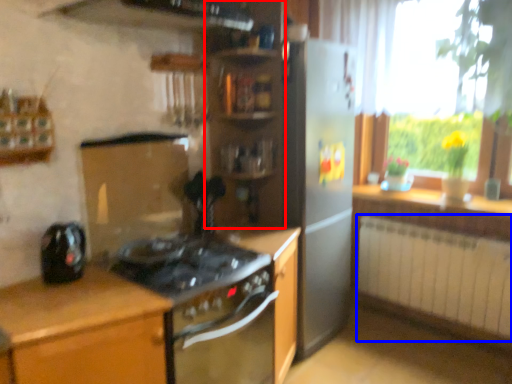
Question: Which object appears closest to the camera in this image, shelf (highlighted by a red box) or radiator (highlighted by a blue box)?

Choices:
 (A) shelf
 (B) radiator

Answer: (A)